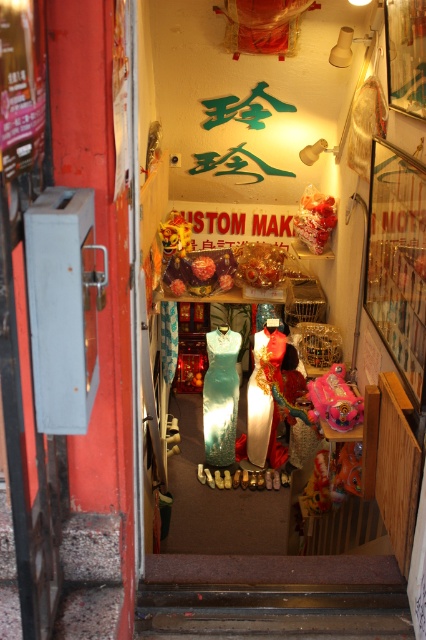
You are a customer in the shop and want to try on the shiny green dress at center and the matte green dress at center. Which dress should you pick up first if you want to start with the one on the left?

The shiny green dress at center is positioned on the left side of matte green dress at center, so you should pick up the shiny green dress at center first.

You are a customer in the shop and want to buy a gift for your friend. You see the shiny pink toy at center and the shiny gold lion at center. Which one is located to the right when facing the entrance?

The shiny pink toy at center is located to the right of the shiny gold lion at center when facing the entrance.